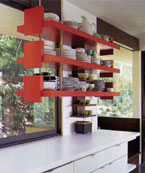
The width and height of the screenshot is (145, 173). Find the location of `white countertop`. white countertop is located at coordinates (55, 149).